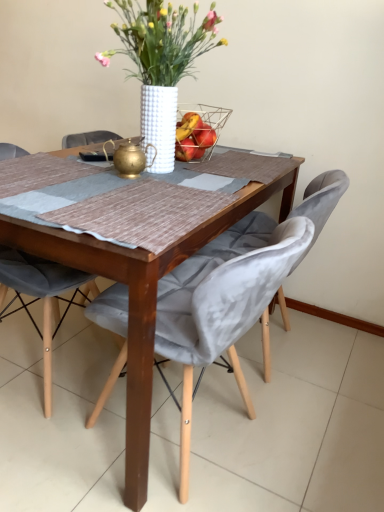
Locate an element on the screen. empty space that is ontop of wooden table at center (from a real-world perspective) is located at coordinates (143, 173).